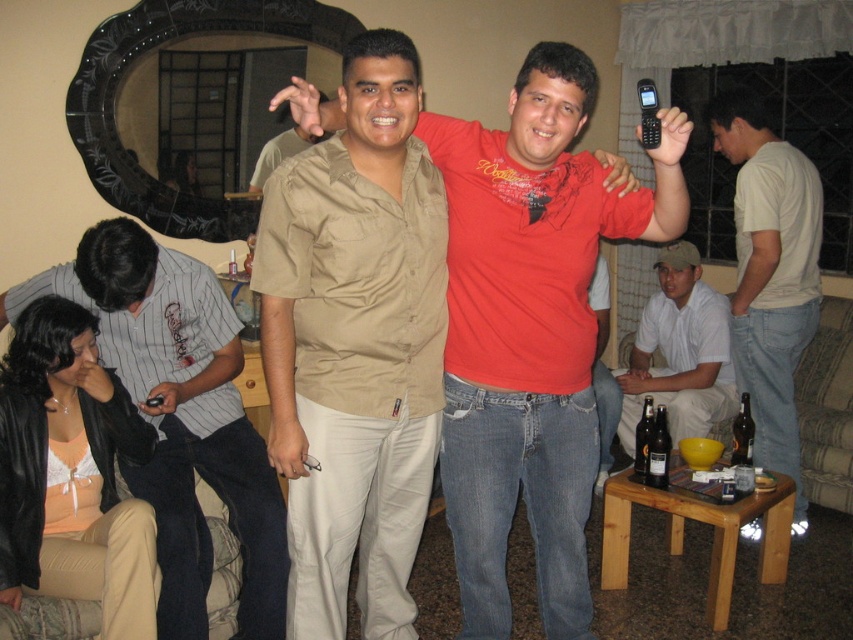
Question: Is striped cotton shirt at lower left bigger than white cotton t-shirt at right?

Choices:
 (A) no
 (B) yes

Answer: (B)

Question: Which point is farther to the camera?

Choices:
 (A) (759, 394)
 (B) (664, 394)
 (C) (225, 394)

Answer: (B)

Question: Which object is positioned farthest from the white cotton t-shirt at right?

Choices:
 (A) white cotton shirt at lower right
 (B) striped cotton shirt at lower left

Answer: (B)

Question: Does striped cotton shirt at lower left appear under white cotton shirt at lower right?

Choices:
 (A) yes
 (B) no

Answer: (A)

Question: Is striped cotton shirt at lower left below white cotton t-shirt at right?

Choices:
 (A) no
 (B) yes

Answer: (B)

Question: Which is farther from the white cotton t-shirt at right?

Choices:
 (A) striped cotton shirt at lower left
 (B) white cotton shirt at lower right

Answer: (A)